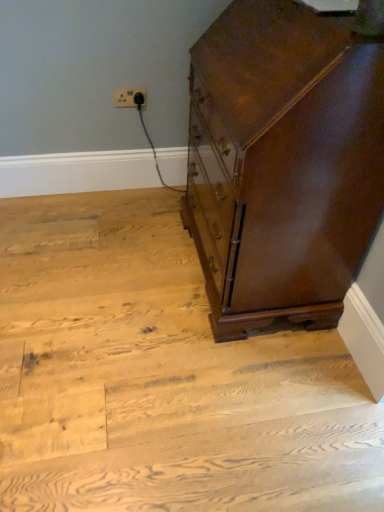
This screenshot has width=384, height=512. In order to click on white plastic outlet at upper center in this screenshot , I will do `click(130, 98)`.

Locate an element on the screen. This screenshot has height=512, width=384. white plastic outlet at upper center is located at coordinates (130, 98).

Considering the sizes of objects white plastic outlet at upper center and shiny brown wood chest of drawers at right in the image provided, who is wider, white plastic outlet at upper center or shiny brown wood chest of drawers at right?

shiny brown wood chest of drawers at right.

The width and height of the screenshot is (384, 512). I want to click on chest of drawers in front of the white plastic outlet at upper center, so click(282, 162).

How distant is white plastic outlet at upper center from shiny brown wood chest of drawers at right?

38.15 inches.

From the picture: Who is shorter, white plastic outlet at upper center or shiny brown wood chest of drawers at right?

With less height is white plastic outlet at upper center.

Is wooden floor at center oriented away from shiny brown wood chest of drawers at right?

No, wooden floor at center is not facing the opposite direction of shiny brown wood chest of drawers at right.

Considering the positions of objects wooden floor at center and shiny brown wood chest of drawers at right in the image provided, who is more to the right, wooden floor at center or shiny brown wood chest of drawers at right?

shiny brown wood chest of drawers at right is more to the right.

Would you say wooden floor at center contains shiny brown wood chest of drawers at right?

That's incorrect, shiny brown wood chest of drawers at right is not inside wooden floor at center.

Locate an element on the screen. This screenshot has height=512, width=384. electric outlet positioned vertically above the wooden floor at center (from a real-world perspective) is located at coordinates (130, 98).

Considering the points (197, 438) and (128, 89), which point is behind, point (197, 438) or point (128, 89)?

The point (128, 89) is farther from the camera.

Is wooden floor at center facing away from white plastic outlet at upper center?

No, white plastic outlet at upper center is not at the back of wooden floor at center.

From a real-world perspective, who is located lower, wooden floor at center or white plastic outlet at upper center?

wooden floor at center.

Does point (342, 215) lie in front of point (114, 101)?

Yes, it is.

Is shiny brown wood chest of drawers at right thinner than white plastic outlet at upper center?

No, shiny brown wood chest of drawers at right is not thinner than white plastic outlet at upper center.

Is shiny brown wood chest of drawers at right far away from white plastic outlet at upper center?

No, shiny brown wood chest of drawers at right is not far from white plastic outlet at upper center.

Considering their positions, is shiny brown wood chest of drawers at right located in front of or behind white plastic outlet at upper center?

Visually, shiny brown wood chest of drawers at right is located in front of white plastic outlet at upper center.

Relative to wooden floor at center, is white plastic outlet at upper center in front or behind?

In the image, white plastic outlet at upper center appears behind wooden floor at center.

From a real-world perspective, is white plastic outlet at upper center physically located above or below wooden floor at center?

white plastic outlet at upper center is situated higher than wooden floor at center in the real world.

Is white plastic outlet at upper center bigger or smaller than wooden floor at center?

white plastic outlet at upper center is smaller than wooden floor at center.

Where is `stairwell directly beneath the white plastic outlet at upper center (from a real-world perspective)`? Image resolution: width=384 pixels, height=512 pixels. stairwell directly beneath the white plastic outlet at upper center (from a real-world perspective) is located at coordinates [x=161, y=377].

Measure the distance between shiny brown wood chest of drawers at right and wooden floor at center.

shiny brown wood chest of drawers at right and wooden floor at center are 21.44 inches apart from each other.

Is shiny brown wood chest of drawers at right outside of wooden floor at center?

Yes, shiny brown wood chest of drawers at right is located beyond the bounds of wooden floor at center.

Which is behind, shiny brown wood chest of drawers at right or wooden floor at center?

wooden floor at center is behind.

From a real-world perspective, which object rests below the other?

wooden floor at center.

I want to click on the chest of drawers lying below the white plastic outlet at upper center (from the image's perspective), so click(x=282, y=162).

Identify the location of stairwell on the left of shiny brown wood chest of drawers at right. The height and width of the screenshot is (512, 384). (161, 377).

Looking at the image, which one is located closer to white plastic outlet at upper center, shiny brown wood chest of drawers at right or wooden floor at center?

shiny brown wood chest of drawers at right.

Looking at the image, which one is located closer to shiny brown wood chest of drawers at right, wooden floor at center or white plastic outlet at upper center?

wooden floor at center lies closer to shiny brown wood chest of drawers at right than the other object.

Which object lies nearer to the anchor point wooden floor at center, shiny brown wood chest of drawers at right or white plastic outlet at upper center?

Based on the image, shiny brown wood chest of drawers at right appears to be nearer to wooden floor at center.

Looking at the image, which one is located further to shiny brown wood chest of drawers at right, white plastic outlet at upper center or wooden floor at center?

white plastic outlet at upper center is further to shiny brown wood chest of drawers at right.

Based on their spatial positions, is white plastic outlet at upper center or shiny brown wood chest of drawers at right further from wooden floor at center?

Based on the image, white plastic outlet at upper center appears to be further to wooden floor at center.

Looking at the image, which one is located further to white plastic outlet at upper center, wooden floor at center or shiny brown wood chest of drawers at right?

wooden floor at center lies further to white plastic outlet at upper center than the other object.

In order to click on stairwell between shiny brown wood chest of drawers at right and white plastic outlet at upper center along the z-axis in this screenshot , I will do `click(161, 377)`.